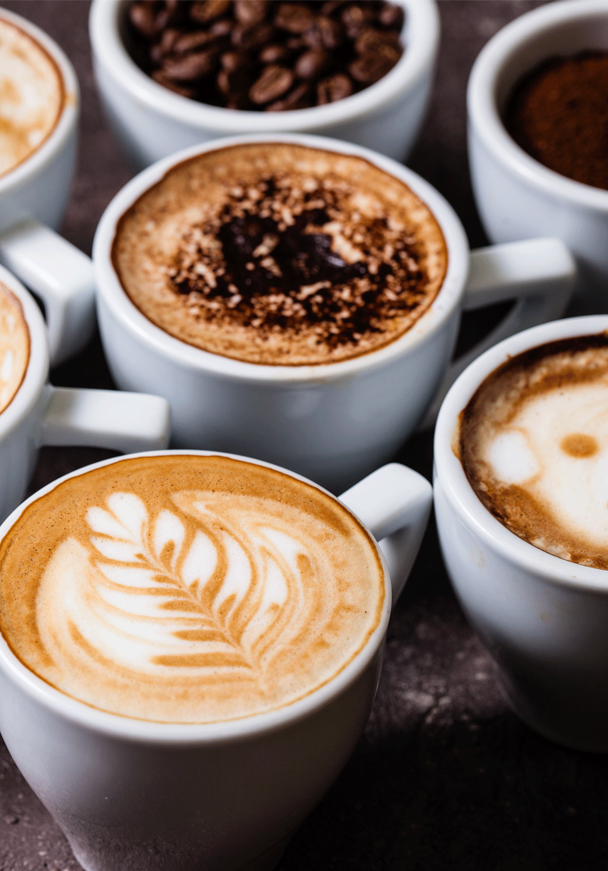
Locate an element on the screen. The height and width of the screenshot is (871, 608). handles is located at coordinates (513, 268), (54, 259), (105, 415), (389, 507).